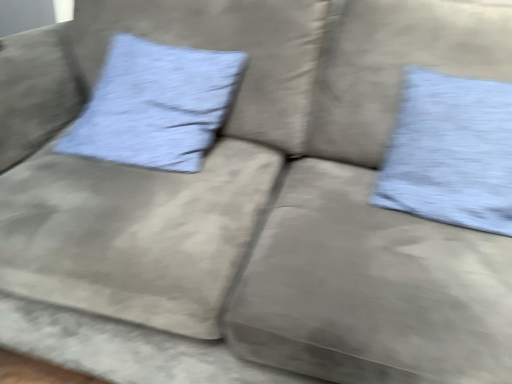
Question: Is light blue textured pillow at upper right, marked as the 1th pillow in a right-to-left arrangement, looking in the opposite direction of blue textured pillow at upper left, the 1th pillow positioned from the left?

Choices:
 (A) yes
 (B) no

Answer: (B)

Question: Is light blue textured pillow at upper right, the 2th pillow when ordered from left to right, oriented towards blue textured pillow at upper left, the 1th pillow positioned from the left?

Choices:
 (A) no
 (B) yes

Answer: (A)

Question: Considering the relative sizes of light blue textured pillow at upper right, marked as the 1th pillow in a right-to-left arrangement, and blue textured pillow at upper left, the 1th pillow positioned from the left, in the image provided, is light blue textured pillow at upper right, marked as the 1th pillow in a right-to-left arrangement, taller than blue textured pillow at upper left, the 1th pillow positioned from the left,?

Choices:
 (A) yes
 (B) no

Answer: (A)

Question: Does light blue textured pillow at upper right, the 2th pillow when ordered from left to right, have a lesser height compared to blue textured pillow at upper left, the second pillow from the right?

Choices:
 (A) no
 (B) yes

Answer: (A)

Question: Is light blue textured pillow at upper right, the 2th pillow when ordered from left to right, thinner than blue textured pillow at upper left, the 1th pillow positioned from the left?

Choices:
 (A) no
 (B) yes

Answer: (B)

Question: Considering the relative positions of light blue textured pillow at upper right, the 2th pillow when ordered from left to right, and blue textured pillow at upper left, the second pillow from the right, in the image provided, is light blue textured pillow at upper right, the 2th pillow when ordered from left to right, to the right of blue textured pillow at upper left, the second pillow from the right, from the viewer's perspective?

Choices:
 (A) no
 (B) yes

Answer: (B)

Question: Is light blue textured pillow at upper right, marked as the 1th pillow in a right-to-left arrangement, at the back of blue textured pillow at upper left, the second pillow from the right?

Choices:
 (A) no
 (B) yes

Answer: (A)

Question: Can you confirm if blue textured pillow at upper left, the second pillow from the right, is positioned to the left of light blue textured pillow at upper right, the 2th pillow when ordered from left to right?

Choices:
 (A) no
 (B) yes

Answer: (B)

Question: From a real-world perspective, does blue textured pillow at upper left, the 1th pillow positioned from the left, sit lower than light blue textured pillow at upper right, marked as the 1th pillow in a right-to-left arrangement?

Choices:
 (A) no
 (B) yes

Answer: (B)

Question: From the image's perspective, is blue textured pillow at upper left, the second pillow from the right, on light blue textured pillow at upper right, the 2th pillow when ordered from left to right?

Choices:
 (A) yes
 (B) no

Answer: (A)

Question: Is blue textured pillow at upper left, the second pillow from the right, positioned before light blue textured pillow at upper right, marked as the 1th pillow in a right-to-left arrangement?

Choices:
 (A) no
 (B) yes

Answer: (A)

Question: From the image's perspective, is blue textured pillow at upper left, the second pillow from the right, located beneath light blue textured pillow at upper right, marked as the 1th pillow in a right-to-left arrangement?

Choices:
 (A) yes
 (B) no

Answer: (B)

Question: In terms of height, does blue textured pillow at upper left, the 1th pillow positioned from the left, look taller or shorter compared to light blue textured pillow at upper right, the 2th pillow when ordered from left to right?

Choices:
 (A) short
 (B) tall

Answer: (A)